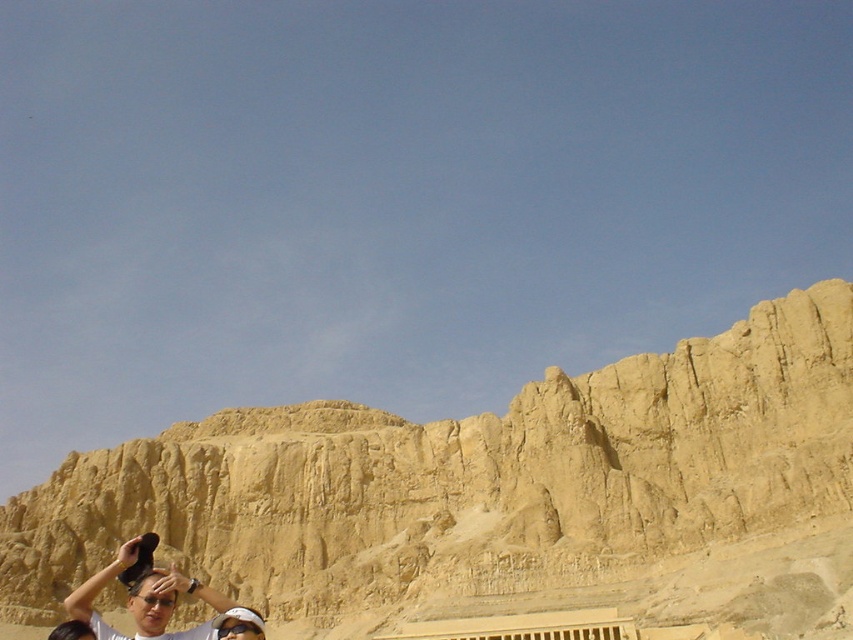
You are a photographer trying to capture both the matte black hat at lower left and the matte black goggles at lower center in your shot. Which object should you focus on first to ensure both are in frame?

The matte black hat at lower left is below the matte black goggles at lower center, so focusing on the matte black goggles at lower center first would allow you to adjust the camera angle to include both objects in the frame.

You are a photographer trying to capture the desert cliff scene. You have two items in your bag, the matte black hat at lower left and the matte black goggles at lower center. Which item should you choose to place on the tripod stand that requires a taller object for stability?

The matte black hat at lower left is much taller than the matte black goggles at lower center, so you should choose the matte black hat at lower left for the tripod stand.

You are a photographer trying to capture the yellow sandstone cliff at center and the matte black goggles at lower center in a single frame. Which object should you focus on first if you want both to be in focus?

The yellow sandstone cliff at center is wider than the matte black goggles at lower center, so you should focus on the yellow sandstone cliff at center first to ensure both are in focus.